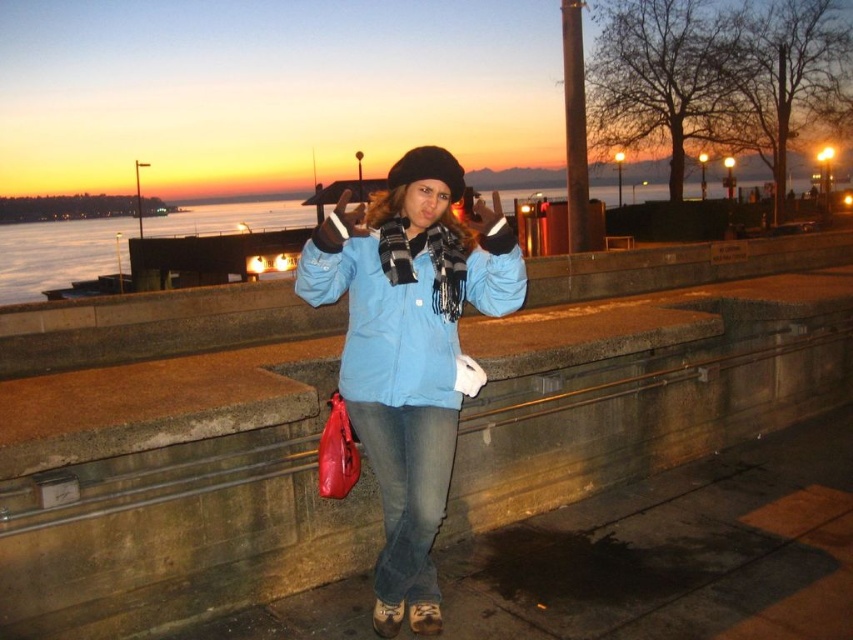
Looking at this image, does concrete at center appear on the left side of matte blue jacket at center?

Yes, concrete at center is to the left of matte blue jacket at center.

Can you confirm if concrete at center is wider than matte blue jacket at center?

No, concrete at center is not wider than matte blue jacket at center.

Describe the element at coordinates (172, 472) in the screenshot. The width and height of the screenshot is (853, 640). I see `concrete at center` at that location.

Where is `concrete at center`? This screenshot has height=640, width=853. concrete at center is located at coordinates (172, 472).

Which is behind, point (733, 257) or point (437, 360)?

The point (733, 257) is more distant.

Between concrete at center and blue matte jacket at center, which one is positioned lower?

concrete at center is lower down.

Does point (160, 508) come in front of point (427, 461)?

That is False.

The image size is (853, 640). I want to click on concrete at center, so click(x=172, y=472).

Who is more distant from viewer, (543, 388) or (379, 458)?

The point (543, 388) is behind.

Locate an element on the screen. The height and width of the screenshot is (640, 853). concrete at center is located at coordinates (172, 472).